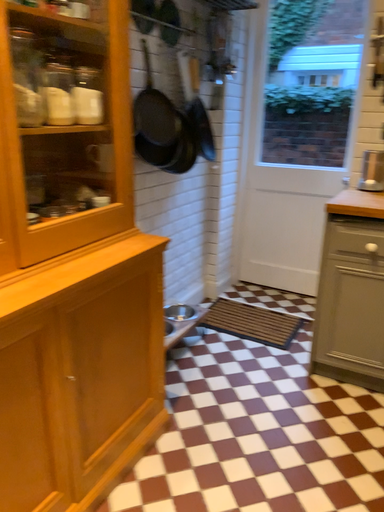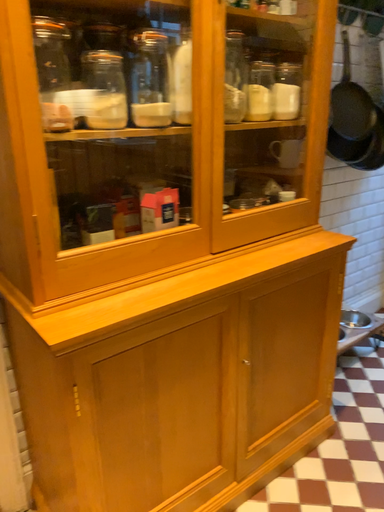
Question: How did the camera likely rotate when shooting the video?

Choices:
 (A) rotated right
 (B) rotated left

Answer: (B)